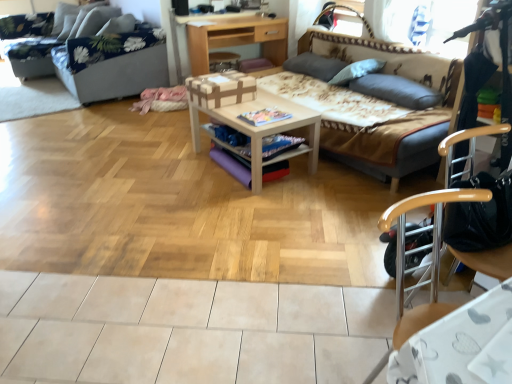
Where is `free space to the left of white wood table at center`? The height and width of the screenshot is (384, 512). free space to the left of white wood table at center is located at coordinates (162, 167).